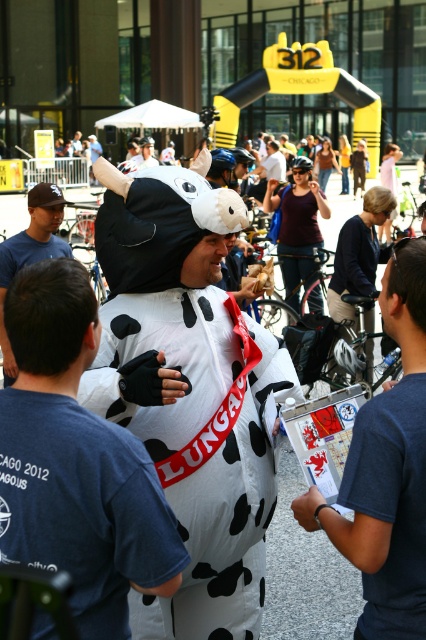
Consider the image. You are a participant in the event and need to locate the starting point. You have a white paper map at center in your hand. Where on the map should you look to find the starting point?

The starting point is likely marked at the position of the white paper map at center, which is at point (386, 470) on the map.